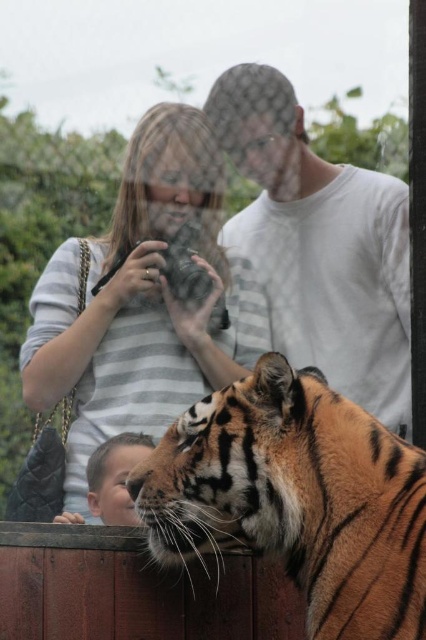
What is the 2D coordinate of the striped fabric shirt at upper center in the image?

The striped fabric shirt at upper center is located at the 2D coordinate point of (143,301).